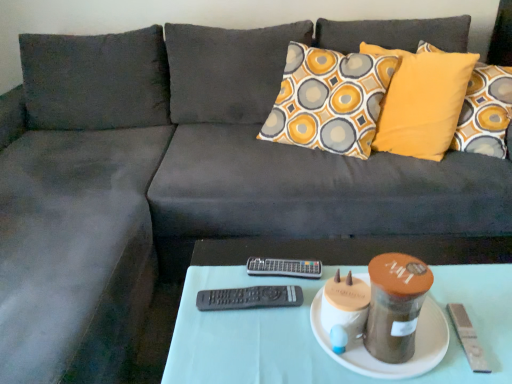
Question: Which direction should I rotate to look at black plastic remote at center, placed as the first remote when sorted from back to front, — up or down?

Choices:
 (A) up
 (B) down

Answer: (B)

Question: Can you confirm if black plastic remote at center, placed as the first remote when sorted from back to front, is smaller than white ceramic plate at center?

Choices:
 (A) yes
 (B) no

Answer: (A)

Question: Is the depth of black plastic remote at center, marked as the second remote in a bottom-to-top arrangement, greater than that of white ceramic plate at center?

Choices:
 (A) yes
 (B) no

Answer: (A)

Question: Can you confirm if black plastic remote at center, which is counted as the second remote, starting from the front, is positioned to the left of white ceramic plate at center?

Choices:
 (A) no
 (B) yes

Answer: (B)

Question: Does black plastic remote at center, placed as the first remote when sorted from back to front, have a greater height compared to white ceramic plate at center?

Choices:
 (A) no
 (B) yes

Answer: (A)

Question: Can we say black plastic remote at center, marked as the second remote in a bottom-to-top arrangement, lies outside white ceramic plate at center?

Choices:
 (A) no
 (B) yes

Answer: (B)

Question: From a real-world perspective, is black plastic remote at center, placed as the first remote when sorted from back to front, positioned under white ceramic plate at center based on gravity?

Choices:
 (A) yes
 (B) no

Answer: (B)

Question: Is white fabric table at center completely or partially outside of black plastic remote at center, the 1th remote when ordered from front to back?

Choices:
 (A) no
 (B) yes

Answer: (B)

Question: Is white fabric table at center closer to the viewer compared to black plastic remote at center, marked as the 2th remote in a top-to-bottom arrangement?

Choices:
 (A) no
 (B) yes

Answer: (B)

Question: Is the depth of white fabric table at center greater than that of black plastic remote at center, the 1th remote when ordered from front to back?

Choices:
 (A) no
 (B) yes

Answer: (A)

Question: Considering the relative sizes of white fabric table at center and black plastic remote at center, the second remote when ordered from back to front, in the image provided, is white fabric table at center smaller than black plastic remote at center, the second remote when ordered from back to front,?

Choices:
 (A) no
 (B) yes

Answer: (A)

Question: Is black plastic remote at center, the 1th remote when ordered from front to back, a part of white fabric table at center?

Choices:
 (A) yes
 (B) no

Answer: (B)

Question: Considering the relative sizes of white fabric table at center and black plastic remote at center, the 1th remote when ordered from bottom to top, in the image provided, is white fabric table at center bigger than black plastic remote at center, the 1th remote when ordered from bottom to top,?

Choices:
 (A) no
 (B) yes

Answer: (B)

Question: Is black plastic remote at center, the second remote when ordered from back to front, outside white fabric table at center?

Choices:
 (A) no
 (B) yes

Answer: (B)